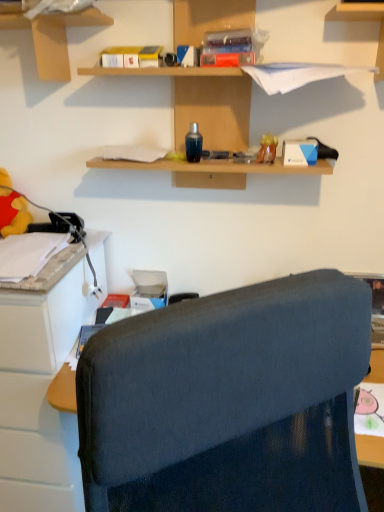
Question: From the image's perspective, does yellow plush toy at left, which is counted as the second toy, starting from the front, appear lower than matte plastic toy at upper right, the 1th toy positioned from the right?

Choices:
 (A) no
 (B) yes

Answer: (B)

Question: Is yellow plush toy at left, which is counted as the second toy, starting from the front, further to the viewer compared to matte plastic toy at upper right, which is counted as the first toy, starting from the front?

Choices:
 (A) yes
 (B) no

Answer: (A)

Question: Can matte plastic toy at upper right, which ranks as the second toy in left-to-right order, be found inside yellow plush toy at left, the second toy when ordered from right to left?

Choices:
 (A) yes
 (B) no

Answer: (B)

Question: Is matte plastic toy at upper right, which ranks as the second toy in left-to-right order, at the back of yellow plush toy at left, which is counted as the second toy, starting from the front?

Choices:
 (A) yes
 (B) no

Answer: (B)

Question: Does yellow plush toy at left, which is counted as the second toy, starting from the front, appear on the left side of matte plastic toy at upper right, which is counted as the first toy, starting from the front?

Choices:
 (A) no
 (B) yes

Answer: (B)

Question: Can you confirm if yellow plush toy at left, marked as the 1th toy in a back-to-front arrangement, is thinner than matte plastic toy at upper right, which is the second toy in back-to-front order?

Choices:
 (A) yes
 (B) no

Answer: (B)

Question: Is white plastic cabinet at left facing away from matte cardboard box at upper left, placed as the second shelf when sorted from right to left?

Choices:
 (A) yes
 (B) no

Answer: (B)

Question: Can you confirm if white plastic cabinet at left is thinner than matte cardboard box at upper left, placed as the second shelf when sorted from right to left?

Choices:
 (A) yes
 (B) no

Answer: (B)

Question: Is white plastic cabinet at left at the right side of matte cardboard box at upper left, arranged as the 1th shelf when viewed from the left?

Choices:
 (A) no
 (B) yes

Answer: (A)

Question: Considering the relative sizes of white plastic cabinet at left and matte cardboard box at upper left, arranged as the 1th shelf when viewed from the left, in the image provided, is white plastic cabinet at left shorter than matte cardboard box at upper left, arranged as the 1th shelf when viewed from the left,?

Choices:
 (A) yes
 (B) no

Answer: (B)

Question: From the image's perspective, would you say white plastic cabinet at left is positioned over matte cardboard box at upper left, placed as the second shelf when sorted from right to left?

Choices:
 (A) yes
 (B) no

Answer: (B)

Question: Is the position of white plastic cabinet at left less distant than that of matte cardboard box at upper left, placed as the second shelf when sorted from right to left?

Choices:
 (A) no
 (B) yes

Answer: (A)

Question: Is wooden shelves at upper center, which is counted as the second shelf, starting from the left, turned away from matte cardboard box at upper left, placed as the second shelf when sorted from right to left?

Choices:
 (A) no
 (B) yes

Answer: (A)